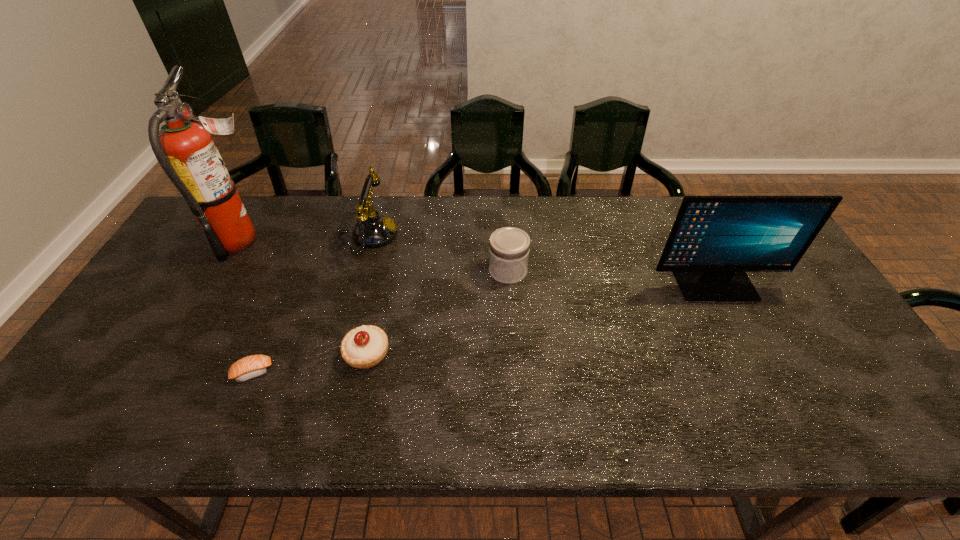
Where is `fire extinguisher`? The height and width of the screenshot is (540, 960). fire extinguisher is located at coordinates (184, 148).

Where is `the leftmost object`? the leftmost object is located at coordinates (184, 148).

You are a GUI agent. You are given a task and a screenshot of the screen. Output one action in this format:
    pyautogui.click(x=<x>, y=<y>)
    Task: Click on the monitor
    The width and height of the screenshot is (960, 540).
    Given the screenshot: What is the action you would take?
    pyautogui.click(x=715, y=240)

Where is `the second tallest object`? the second tallest object is located at coordinates (715, 240).

What are the coordinates of `telephone` in the screenshot? It's located at (372, 230).

This screenshot has height=540, width=960. Find the location of `the fourth tallest object`. the fourth tallest object is located at coordinates (509, 247).

The height and width of the screenshot is (540, 960). What are the coordinates of `the second object from right to left` in the screenshot? It's located at (509, 247).

Locate an element on the screen. The width and height of the screenshot is (960, 540). the second shortest object is located at coordinates (363, 347).

Image resolution: width=960 pixels, height=540 pixels. What are the coordinates of `the shortest object` in the screenshot? It's located at (250, 367).

The width and height of the screenshot is (960, 540). Identify the location of the fifth object from right to left. (250, 367).